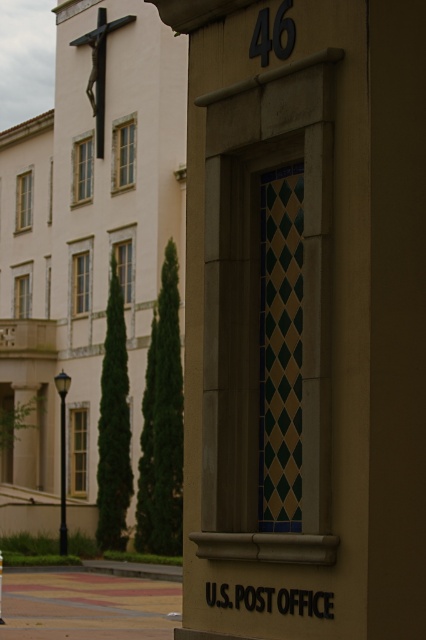
Question: Does paved brick sidewalk at lower left appear on the left side of smooth black pole at left?

Choices:
 (A) yes
 (B) no

Answer: (B)

Question: Is paved brick sidewalk at lower left bigger than smooth black pole at left?

Choices:
 (A) no
 (B) yes

Answer: (B)

Question: Which point is farther from the camera taking this photo?

Choices:
 (A) (98, 109)
 (B) (63, 401)
 (C) (57, 584)

Answer: (A)

Question: Does paved brick sidewalk at lower left have a greater width compared to black metal crucifix at upper left?

Choices:
 (A) yes
 (B) no

Answer: (A)

Question: Which object is farther from the camera taking this photo?

Choices:
 (A) black metal crucifix at upper left
 (B) smooth black pole at left
 (C) paved brick sidewalk at lower left

Answer: (A)

Question: Which object is the closest to the black metal crucifix at upper left?

Choices:
 (A) paved brick sidewalk at lower left
 (B) smooth black pole at left

Answer: (B)